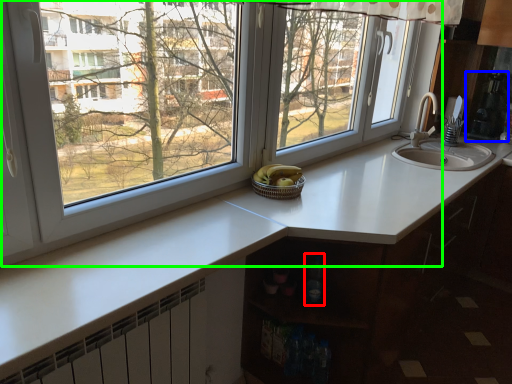
Question: Which is farther away from bottle (highlighted by a red box)? appliance (highlighted by a blue box) or window (highlighted by a green box)?

Choices:
 (A) appliance
 (B) window

Answer: (A)